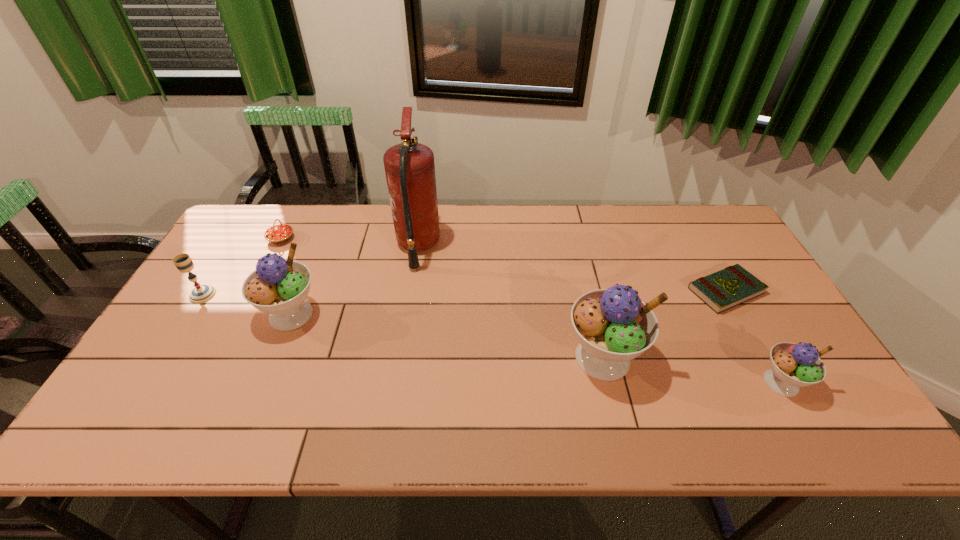
Locate an element on the screen. This screenshot has width=960, height=540. chalice positioned at the left edge is located at coordinates (202, 293).

You are a GUI agent. You are given a task and a screenshot of the screen. Output one action in this format:
    pyautogui.click(x=<x>, y=<y>)
    Task: Click on the icecream present at the right edge
    The image size is (960, 540).
    Given the screenshot: What is the action you would take?
    pyautogui.click(x=793, y=365)

Locate an element on the screen. This screenshot has height=540, width=960. book located at the right edge is located at coordinates tap(734, 285).

The width and height of the screenshot is (960, 540). Identify the location of object located in the far left corner section of the desktop. (277, 234).

This screenshot has width=960, height=540. I want to click on object that is at the near right corner, so click(793, 365).

What are the coordinates of `vacant space at the far edge of the desktop` in the screenshot? It's located at (626, 228).

Image resolution: width=960 pixels, height=540 pixels. In the image, there is a desktop. What are the coordinates of `vacant space at the near edge` in the screenshot? It's located at (728, 387).

This screenshot has width=960, height=540. Find the location of `vacant space at the left edge`. vacant space at the left edge is located at coordinates click(230, 278).

Identify the location of vacant region between the rightmost icecream and the leftmost icecream. (536, 348).

This screenshot has height=540, width=960. I want to click on free space between the second icecream from left to right and the strawberry, so click(442, 298).